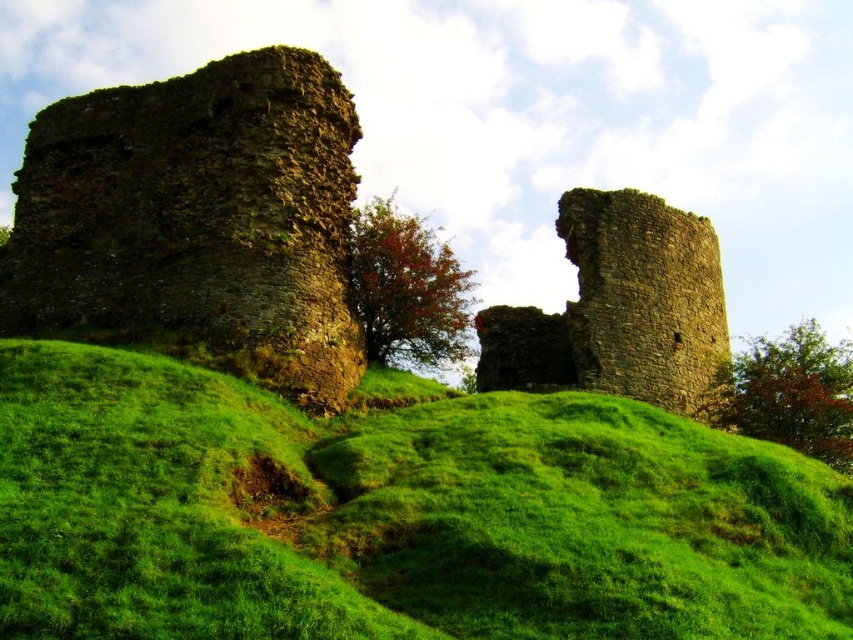
You are standing at the base of the hill where the medieval castle ruins are located. You notice a point marked at coordinates [393,513]. Based on the scene description, what does this point most likely represent?

The point at [393,513] corresponds to the green grassy hillside at center, which is part of the foreground dominated by lush green grass leading up to the ruins.

Consider the image. You are standing at the base of the hill looking up at the ruins. There is a point marked at coordinates (198, 220). Which object does this point indicate?

The point at coordinates (198, 220) indicates the rustic stone castle at upper left.